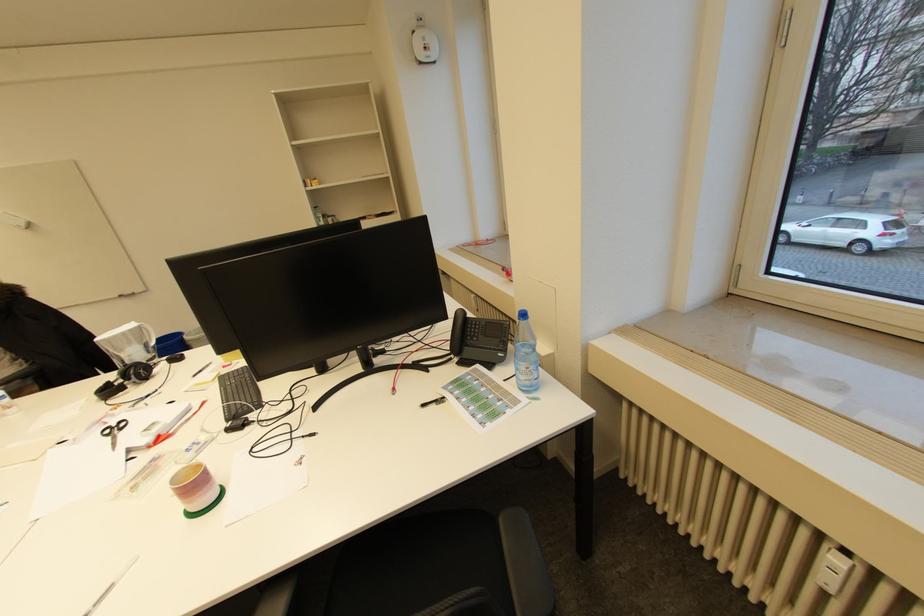
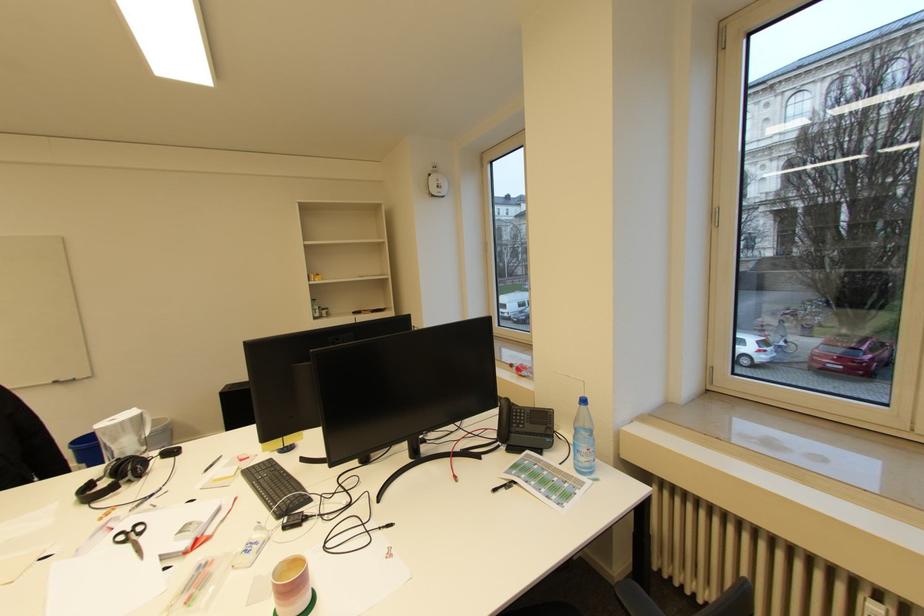
Question: What movement of the cameraman would produce the second image?

Choices:
 (A) Left
 (B) Right
 (C) Forward
 (D) Backward

Answer: (A)